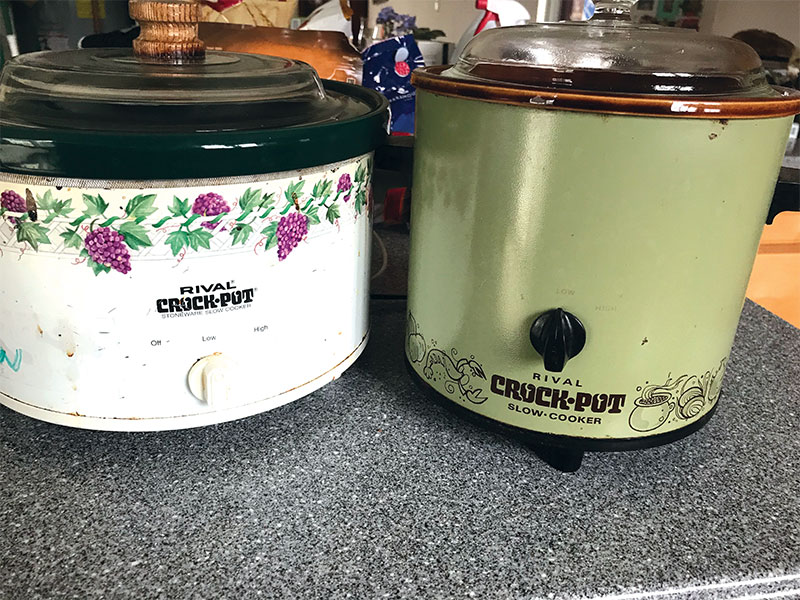
You are a GUI agent. You are given a task and a screenshot of the screen. Output one action in this format:
    pyautogui.click(x=<x>, y=<y>)
    Task: Click on the crock pots
    
    Given the screenshot: What is the action you would take?
    pyautogui.click(x=325, y=321), pyautogui.click(x=542, y=317)